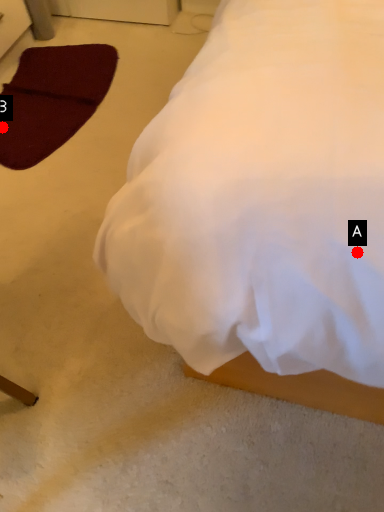
Question: Two points are circled on the image, labeled by A and B beside each circle. Which point appears closest to the camera in this image?

Choices:
 (A) A is closer
 (B) B is closer

Answer: (A)